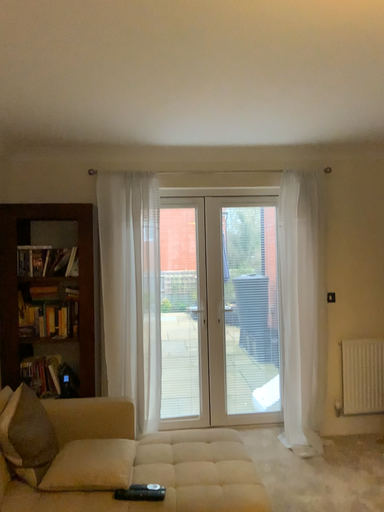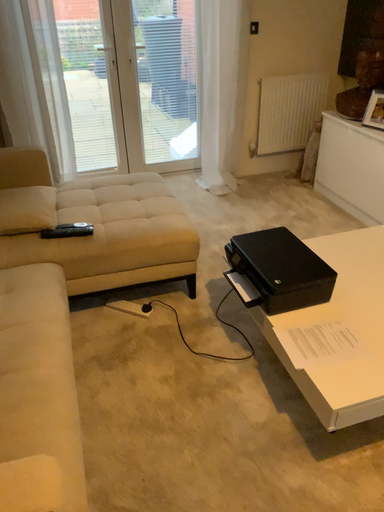
Question: Which way did the camera rotate in the video?

Choices:
 (A) rotated upward
 (B) rotated downward

Answer: (B)